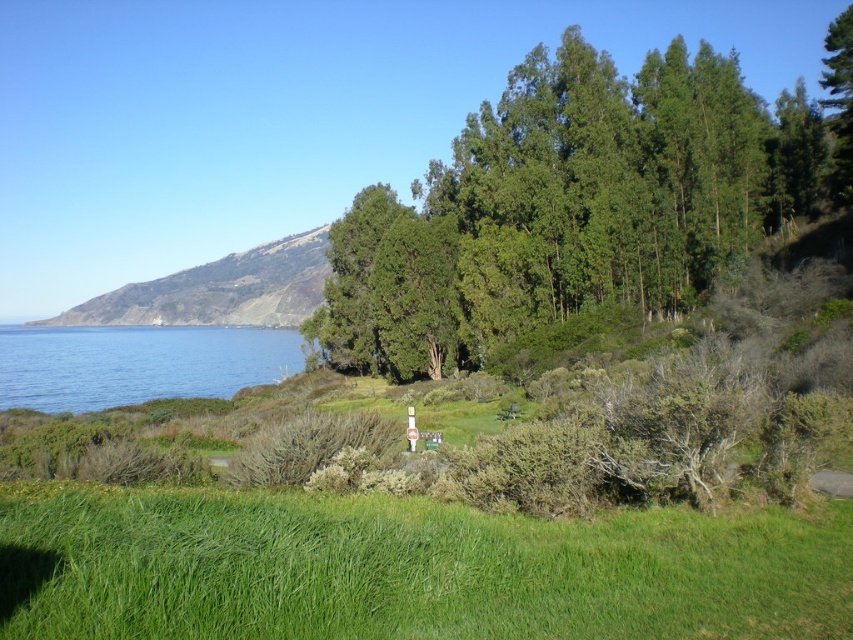
You are standing at the viewpoint and want to know how far the point at coordinates (148,369) is from you. Can you determine the distance?

The point at coordinates (148,369) is 138.52 meters away from the viewer.

You are a hiker trying to find the best spot to set up a tent. You have two options in the image provided. The first option is the green grassy field at lower center, and the second is the green leafy trees at center. Considering the space available, which location would you choose and why?

The green grassy field at lower center is thinner than the green leafy trees at center, so the green leafy trees at center provide a wider area for setting up a tent.

You are planning to set up a picnic area in the scene described. Considering the green leafy trees at center and the green grassy hillside at left, which location would provide more shade?

The green grassy hillside at left is taller than the green leafy trees at center, so the green grassy hillside at left would provide more shade.